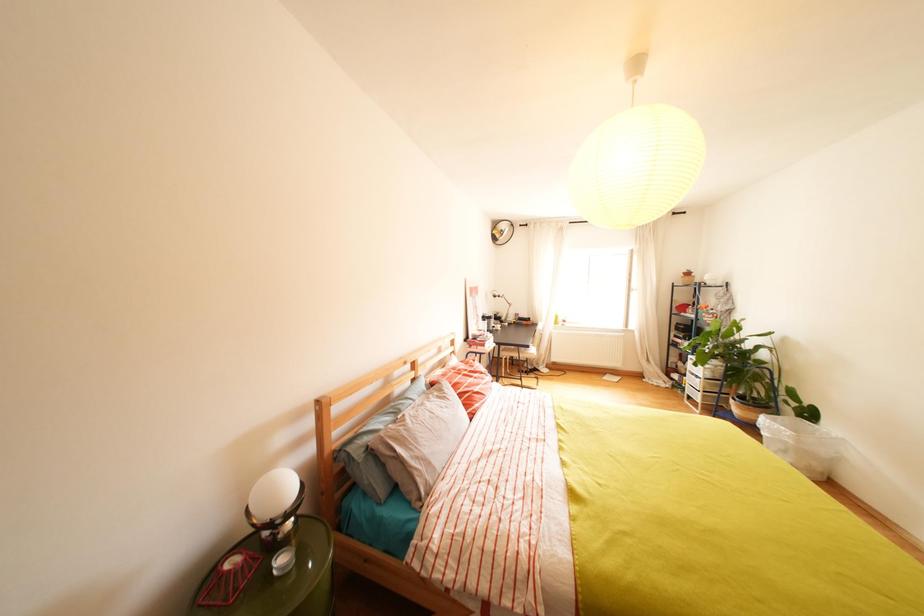
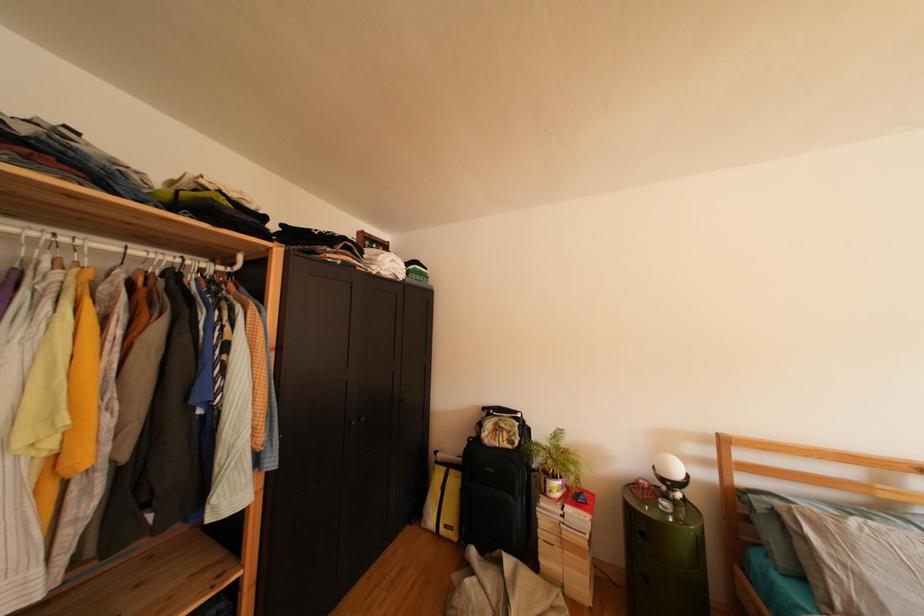
Question: The camera is either moving clockwise (left) or counter-clockwise (right) around the object. The first image is from the beginning of the video and the second image is from the end. Is the camera moving left or right when shooting the video?

Choices:
 (A) Left
 (B) Right

Answer: (B)